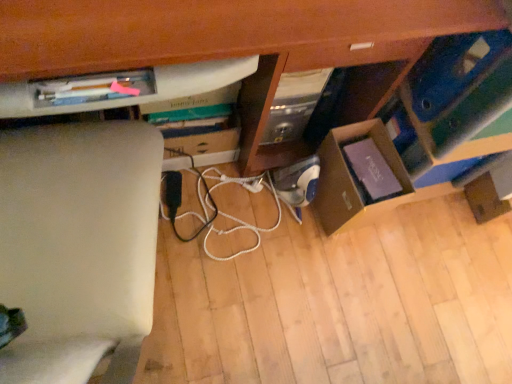
Question: Is wooden computer desk at center taller or shorter than cardboard box at lower right?

Choices:
 (A) short
 (B) tall

Answer: (B)

Question: From the image's perspective, is wooden computer desk at center located above or below cardboard box at lower right?

Choices:
 (A) below
 (B) above

Answer: (B)

Question: Which object is positioned closest to the wooden computer desk at center?

Choices:
 (A) blue cardboard box at lower right
 (B) cardboard box at lower right
 (C) white cord at center

Answer: (A)

Question: Which of these objects is positioned farthest from the white cord at center?

Choices:
 (A) blue cardboard box at lower right
 (B) cardboard box at lower right
 (C) wooden computer desk at center

Answer: (A)